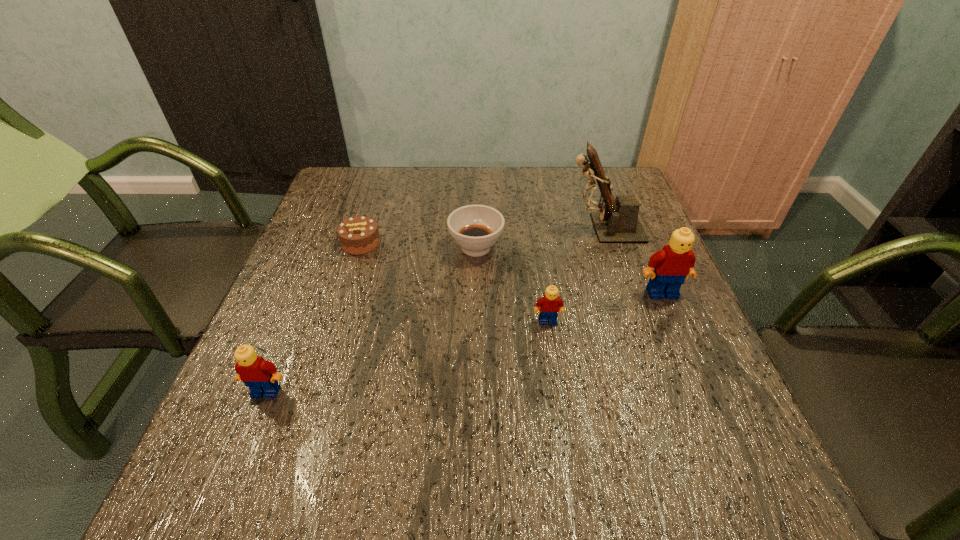
At what (x,y) coordinates should I click in order to perform the action: click on blank region between the second Lego from left to right and the figurine. Please return your answer as a coordinate pair (x, y). Image resolution: width=960 pixels, height=540 pixels. Looking at the image, I should click on (575, 275).

In order to click on free spot between the soup bowl and the figurine in this screenshot , I will do `click(540, 238)`.

I want to click on empty space that is in between the soup bowl and the tallest Lego, so click(x=569, y=270).

Where is `vacant space that's between the fourth object from left to right and the chocolate cake`? The height and width of the screenshot is (540, 960). vacant space that's between the fourth object from left to right and the chocolate cake is located at coordinates (454, 282).

The image size is (960, 540). What are the coordinates of `vacant region between the third shortest object and the figurine` in the screenshot? It's located at (575, 275).

The width and height of the screenshot is (960, 540). What are the coordinates of `free area in between the fourth farthest object and the figurine` in the screenshot? It's located at (633, 260).

In order to click on blank region between the chocolate cake and the tallest Lego in this screenshot , I will do `click(512, 268)`.

In order to click on free space between the soup bowl and the shortest Lego in this screenshot , I will do `click(512, 284)`.

At what (x,y) coordinates should I click in order to perform the action: click on object that is the closest to the rightmost Lego. Please return your answer as a coordinate pair (x, y). Looking at the image, I should click on [617, 222].

Locate an element on the screen. This screenshot has height=540, width=960. the fourth closest object to the fifth shortest object is located at coordinates (358, 235).